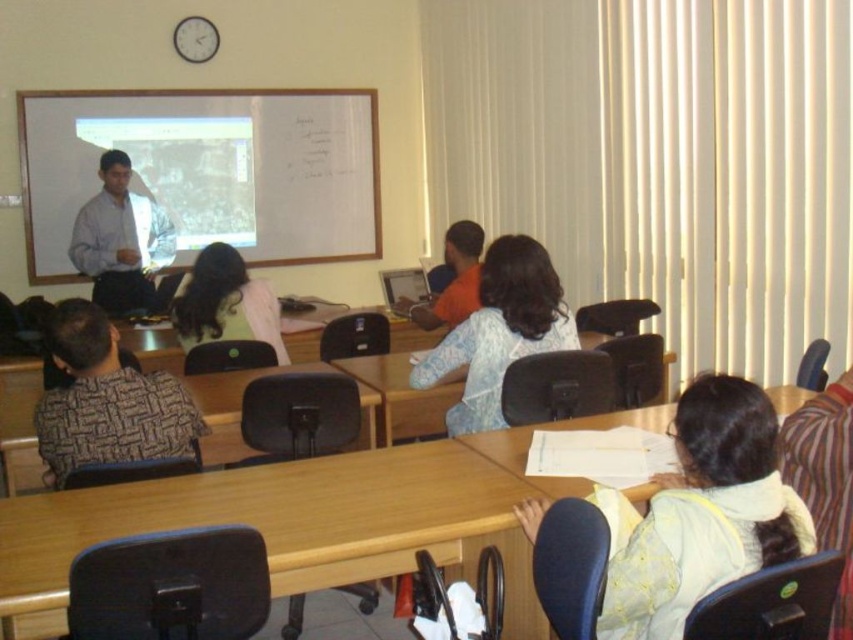
Can you confirm if light yellow fabric at lower right is wider than patterned fabric shirt at left?

Incorrect, light yellow fabric at lower right's width does not surpass patterned fabric shirt at left's.

Is point (640, 556) closer to camera compared to point (61, 404)?

Yes, point (640, 556) is in front of point (61, 404).

The height and width of the screenshot is (640, 853). Describe the element at coordinates (705, 513) in the screenshot. I see `light yellow fabric at lower right` at that location.

You are a GUI agent. You are given a task and a screenshot of the screen. Output one action in this format:
    pyautogui.click(x=<x>, y=<y>)
    Task: Click on the light yellow fabric at lower right
    Image resolution: width=853 pixels, height=640 pixels.
    Given the screenshot: What is the action you would take?
    pyautogui.click(x=705, y=513)

Who is more distant from viewer, (532, 291) or (181, 344)?

The point (181, 344) is behind.

Which of these two, light blue fabric shirt at center or light brown fabric shirt at center, stands taller?

light blue fabric shirt at center

Who is more distant from viewer, [517,234] or [202,312]?

Positioned behind is point [517,234].

I want to click on light blue fabric shirt at center, so click(498, 332).

Does light yellow fabric at lower right have a greater width compared to orange fabric shirt at center?

Yes.

Does light yellow fabric at lower right appear on the right side of orange fabric shirt at center?

Indeed, light yellow fabric at lower right is positioned on the right side of orange fabric shirt at center.

Is point (650, 616) more distant than point (474, 256)?

No, (650, 616) is in front of (474, 256).

Locate an element on the screen. light yellow fabric at lower right is located at coordinates (705, 513).